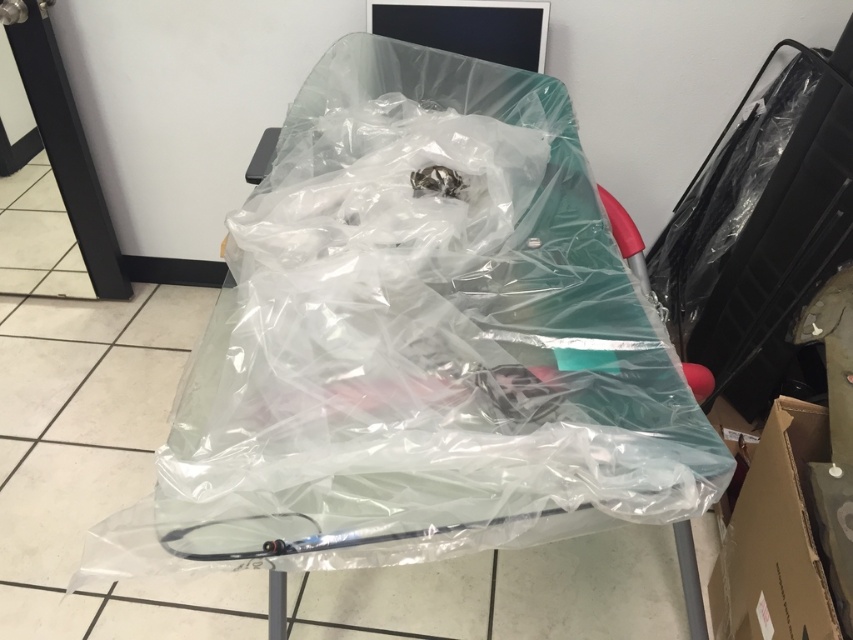
Question: Does transparent plastic bag at center have a smaller size compared to brown cardboard box at lower right?

Choices:
 (A) no
 (B) yes

Answer: (A)

Question: Is transparent plastic bag at center positioned before brown cardboard box at lower right?

Choices:
 (A) no
 (B) yes

Answer: (B)

Question: Considering the relative positions of transparent plastic bag at center and brown cardboard box at lower right in the image provided, where is transparent plastic bag at center located with respect to brown cardboard box at lower right?

Choices:
 (A) left
 (B) right

Answer: (A)